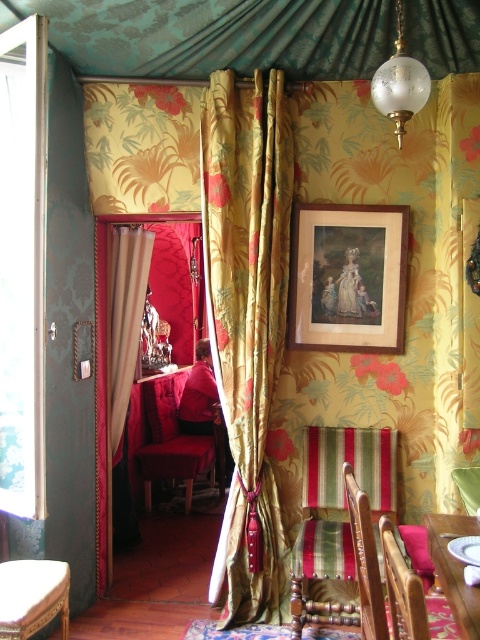
Based on the photo, between beige fabric curtain at left and wooden cushioned stool at lower left, which one is positioned higher?

beige fabric curtain at left

Describe the element at coordinates (117, 380) in the screenshot. I see `beige fabric curtain at left` at that location.

Image resolution: width=480 pixels, height=640 pixels. Identify the location of beige fabric curtain at left. (117, 380).

What do you see at coordinates (348, 276) in the screenshot? I see `wooden frame at upper center` at bounding box center [348, 276].

Between wooden frame at upper center and velvet red armchair at center, which one is positioned lower?

velvet red armchair at center is below.

Between point (391, 342) and point (139, 452), which one is positioned behind?

The point (139, 452) is more distant.

Identify the location of wooden frame at upper center. This screenshot has width=480, height=640. (348, 276).

Does striped fabric armchair at lower right have a greater height compared to wooden polished table at lower right?

Correct, striped fabric armchair at lower right is much taller as wooden polished table at lower right.

Who is lower down, striped fabric armchair at lower right or wooden polished table at lower right?

wooden polished table at lower right is lower down.

Image resolution: width=480 pixels, height=640 pixels. I want to click on striped fabric armchair at lower right, so click(x=364, y=561).

Find the location of a particular element. The width and height of the screenshot is (480, 640). striped fabric armchair at lower right is located at coordinates (364, 561).